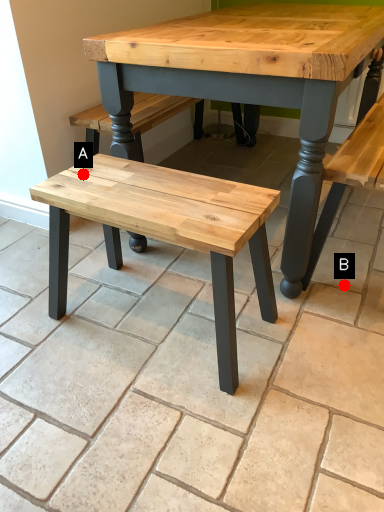
Question: Two points are circled on the image, labeled by A and B beside each circle. Which point is further to the camera?

Choices:
 (A) A is further
 (B) B is further

Answer: (B)